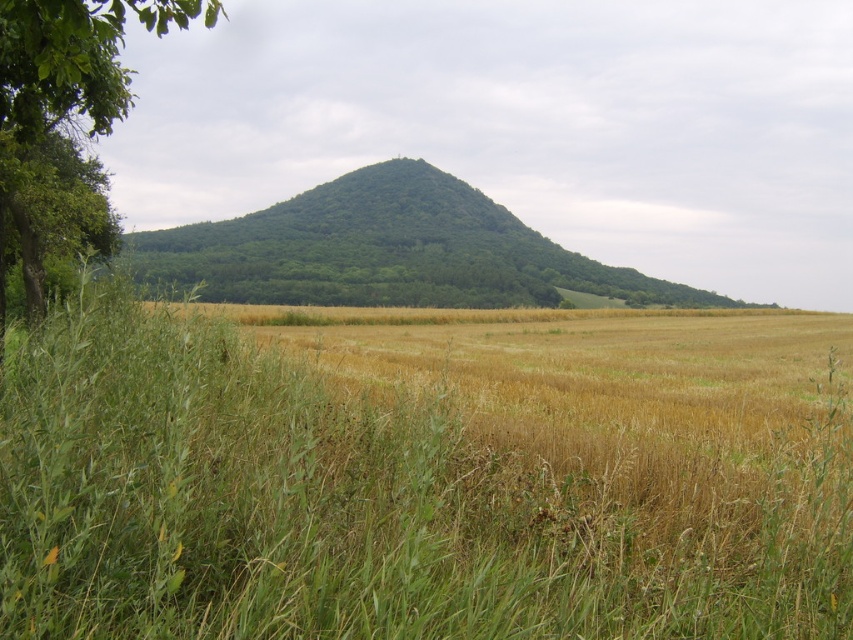
Question: Among these points, which one is farthest from the camera?

Choices:
 (A) (16, 17)
 (B) (39, 433)

Answer: (A)

Question: Which of the following is the farthest from the observer?

Choices:
 (A) (15, 125)
 (B) (645, 435)

Answer: (A)

Question: Among these points, which one is nearest to the camera?

Choices:
 (A) (618, 536)
 (B) (16, 24)

Answer: (A)

Question: Does brown grassy field at center have a smaller size compared to green leafy tree at left?

Choices:
 (A) yes
 (B) no

Answer: (A)

Question: Does brown grassy field at center appear on the left side of green leafy tree at left?

Choices:
 (A) yes
 (B) no

Answer: (B)

Question: Considering the relative positions of brown grassy field at center and green leafy tree at left in the image provided, where is brown grassy field at center located with respect to green leafy tree at left?

Choices:
 (A) right
 (B) left

Answer: (A)